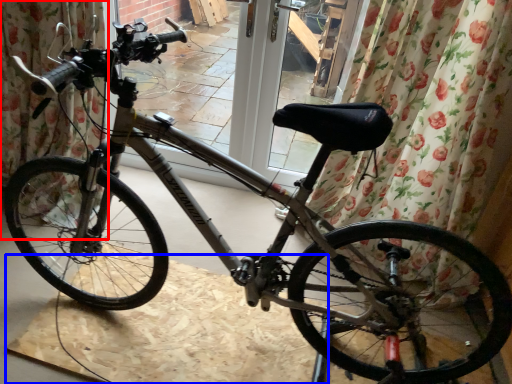
Question: Which object is closer to the camera taking this photo, curtain (highlighted by a red box) or cardboard (highlighted by a blue box)?

Choices:
 (A) curtain
 (B) cardboard

Answer: (B)